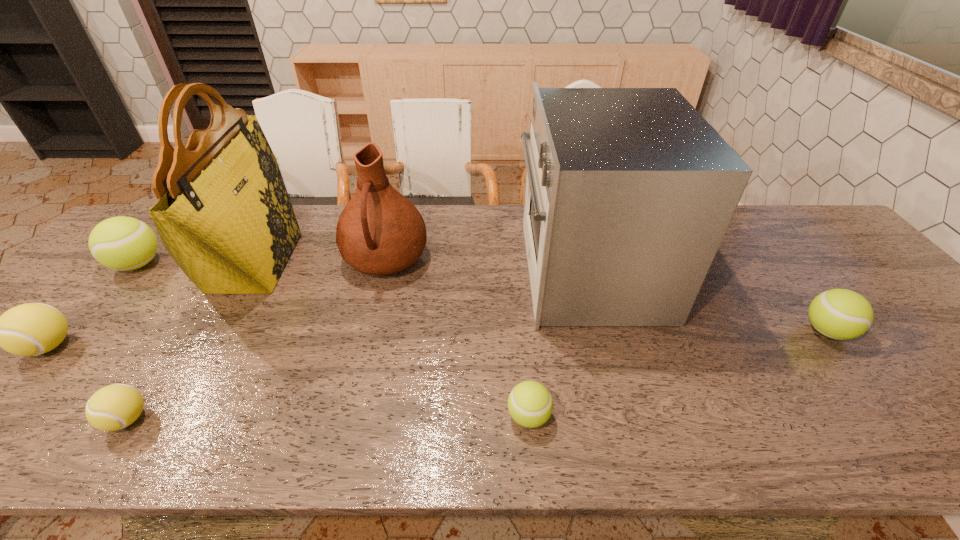
You are a GUI agent. You are given a task and a screenshot of the screen. Output one action in this format:
    pyautogui.click(x=<x>, y=<y>)
    Task: Click on the free spot between the fourth tennis ball from left to right and the pitcher
    This screenshot has width=960, height=540.
    Given the screenshot: What is the action you would take?
    pyautogui.click(x=457, y=338)

Locate an element on the screen. blank region between the nearer yellow tennis ball and the fourth tennis ball from left to right is located at coordinates (328, 418).

The width and height of the screenshot is (960, 540). In order to click on the fifth closest object to the yellow tote bag in this screenshot , I will do `click(530, 404)`.

Locate an element on the screen. object that is the second closest to the toaster oven is located at coordinates (380, 232).

Identify which tennis ball is the closest to the pitcher. Please provide its 2D coordinates. Your answer should be formatted as a tuple, i.e. [(x, y)], where the tuple contains the x and y coordinates of a point satisfying the conditions above.

[(530, 404)]

Identify which tennis ball is the second nearest to the toaster oven. Please provide its 2D coordinates. Your answer should be formatted as a tuple, i.e. [(x, y)], where the tuple contains the x and y coordinates of a point satisfying the conditions above.

[(841, 314)]

Locate which green tennis ball is the second closest to the tote bag. Please provide its 2D coordinates. Your answer should be formatted as a tuple, i.e. [(x, y)], where the tuple contains the x and y coordinates of a point satisfying the conditions above.

[(530, 404)]

Locate an element on the screen. This screenshot has width=960, height=540. the third closest green tennis ball to the nearer yellow tennis ball is located at coordinates (841, 314).

The height and width of the screenshot is (540, 960). I want to click on blank space that satisfies the following two spatial constraints: 1. on the front-facing side of the tote bag; 2. on the left side of the smallest green tennis ball, so click(166, 416).

You are a GUI agent. You are given a task and a screenshot of the screen. Output one action in this format:
    pyautogui.click(x=<x>, y=<y>)
    Task: Click on the free space that satisfies the following two spatial constraints: 1. on the side of the fourth object from right to left with the handle; 2. on the right side of the rightmost tennis ball
    
    Given the screenshot: What is the action you would take?
    pyautogui.click(x=369, y=331)